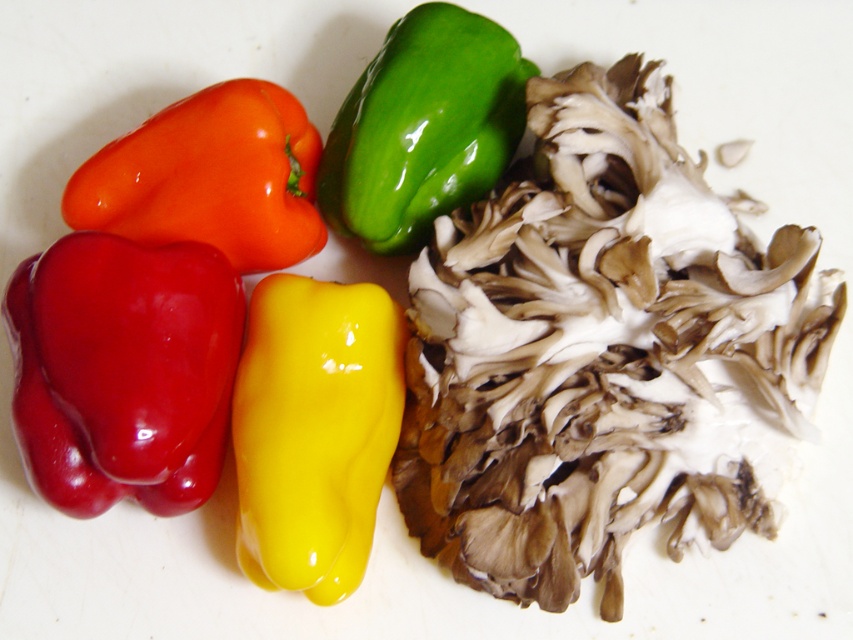
Is green glossy bell pepper at upper left in front of glossy yellow pepper at center?

No.

Who is more forward, (672, 179) or (314, 394)?

Point (672, 179) is more forward.

Who is more distant from viewer, (640, 337) or (305, 404)?

The point (305, 404) is behind.

Locate an element on the screen. green glossy bell pepper at upper left is located at coordinates (602, 353).

Is point (38, 426) behind point (158, 195)?

No, it is in front of (158, 195).

Can you confirm if glossy red bell pepper at lower left is shorter than glossy plastic bell pepper at upper left?

In fact, glossy red bell pepper at lower left may be taller than glossy plastic bell pepper at upper left.

The image size is (853, 640). Describe the element at coordinates (122, 371) in the screenshot. I see `glossy red bell pepper at lower left` at that location.

Identify the location of glossy red bell pepper at lower left. The width and height of the screenshot is (853, 640). (122, 371).

Can you confirm if glossy yellow pepper at center is taller than green glossy bell pepper at upper center?

Yes.

Image resolution: width=853 pixels, height=640 pixels. What do you see at coordinates (314, 429) in the screenshot?
I see `glossy yellow pepper at center` at bounding box center [314, 429].

Find the location of `glossy yellow pepper at center`. glossy yellow pepper at center is located at coordinates (314, 429).